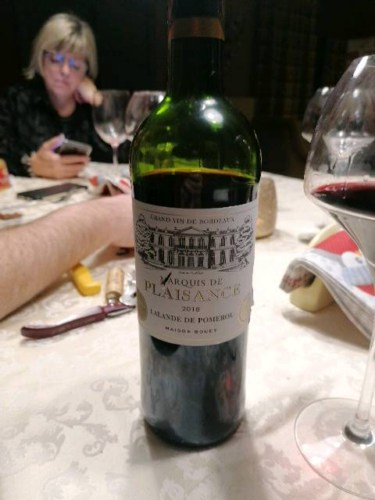
The width and height of the screenshot is (375, 500). Find the location of `white table cloth`. white table cloth is located at coordinates (109, 408).